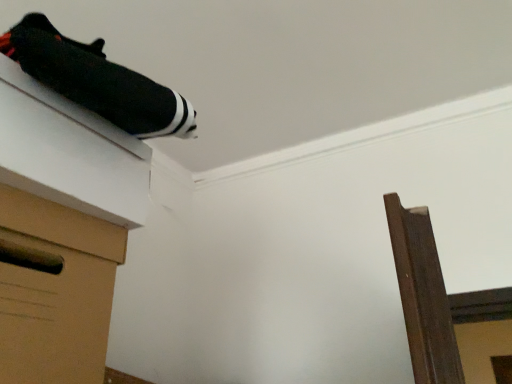
Question: In terms of height, does black fabric shoe at upper left look taller or shorter compared to black fabric at upper left?

Choices:
 (A) tall
 (B) short

Answer: (B)

Question: Looking at their shapes, would you say black fabric shoe at upper left is wider or thinner than black fabric at upper left?

Choices:
 (A) wide
 (B) thin

Answer: (B)

Question: Considering the real-world distances, which object is farthest from the black fabric at upper left?

Choices:
 (A) black fabric shoe at upper left
 (B) brown cardboard drawer at lower left

Answer: (A)

Question: Which of these objects is positioned closest to the brown cardboard drawer at lower left?

Choices:
 (A) black fabric shoe at upper left
 (B) black fabric at upper left

Answer: (B)